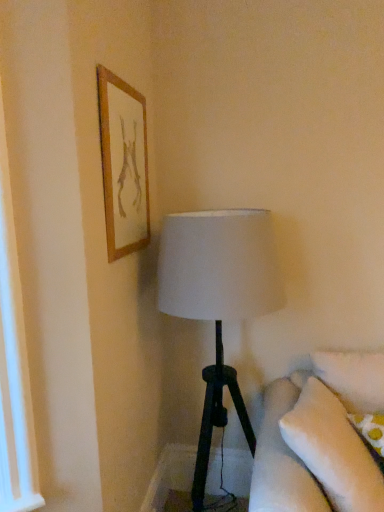
What is the approximate height of wooden picture frame at upper left?

wooden picture frame at upper left is 25.25 inches in height.

The width and height of the screenshot is (384, 512). What do you see at coordinates (123, 164) in the screenshot?
I see `wooden picture frame at upper left` at bounding box center [123, 164].

The image size is (384, 512). What are the coordinates of `wooden picture frame at upper left` in the screenshot? It's located at (123, 164).

Image resolution: width=384 pixels, height=512 pixels. What are the coordinates of `wooden picture frame at upper left` in the screenshot? It's located at (123, 164).